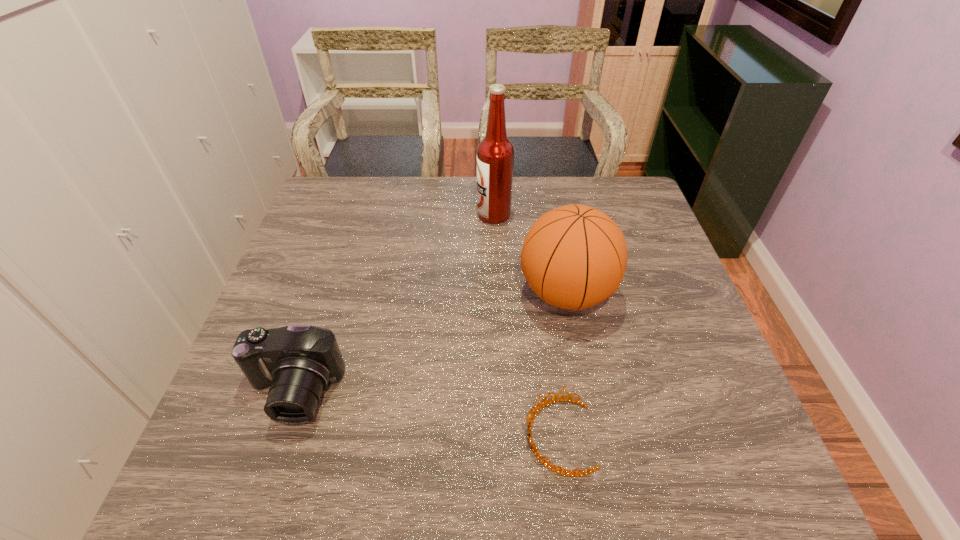
Locate an element on the screen. This screenshot has width=960, height=540. unoccupied position between the third tallest object and the basketball is located at coordinates (430, 343).

Where is `free space between the third shortest object and the second shortest object`? The image size is (960, 540). free space between the third shortest object and the second shortest object is located at coordinates (430, 343).

This screenshot has width=960, height=540. What are the coordinates of `free space that is in between the second tallest object and the shortest object` in the screenshot? It's located at (563, 364).

Locate an element on the screen. This screenshot has width=960, height=540. empty space between the tiara and the leftmost object is located at coordinates (426, 414).

Find the location of a particular element. object that is the second closest to the alcohol is located at coordinates [x=298, y=362].

This screenshot has height=540, width=960. What are the coordinates of `the closest object relative to the tallest object` in the screenshot? It's located at (574, 257).

Where is `free spot that satisfies the following two spatial constraints: 1. on the label side of the farthest object; 2. on the right side of the third shortest object`? The image size is (960, 540). free spot that satisfies the following two spatial constraints: 1. on the label side of the farthest object; 2. on the right side of the third shortest object is located at coordinates (496, 293).

Where is `vacant region that satisfies the following two spatial constraints: 1. on the back side of the second tallest object; 2. on the label side of the alcohol`? The width and height of the screenshot is (960, 540). vacant region that satisfies the following two spatial constraints: 1. on the back side of the second tallest object; 2. on the label side of the alcohol is located at coordinates (551, 214).